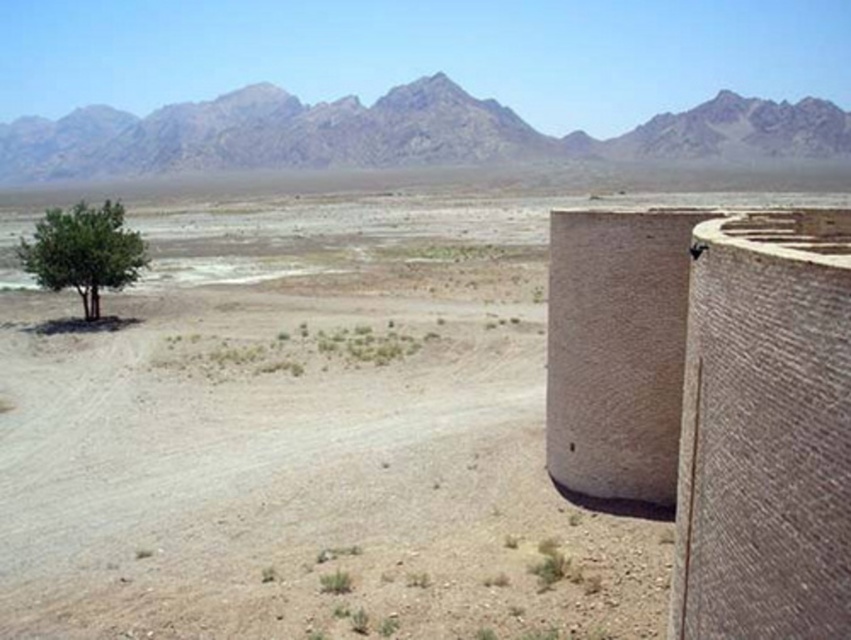
The height and width of the screenshot is (640, 851). Find the location of `dull brown dirt at center`. dull brown dirt at center is located at coordinates (318, 417).

Which of these two, dull brown dirt at center or rugged stone mountain at upper center, stands taller?

Standing taller between the two is dull brown dirt at center.

Does point (164, 499) lie in front of point (750, 122)?

Yes, it is.

Where is `dull brown dirt at center`? This screenshot has height=640, width=851. dull brown dirt at center is located at coordinates (318, 417).

Does brown textured fort at right have a greater height compared to green leafy tree at left?

Answer: In fact, brown textured fort at right may be shorter than green leafy tree at left.

Who is positioned more to the left, brown textured fort at right or green leafy tree at left?

green leafy tree at left is more to the left.

Between point (564, 236) and point (60, 209), which one is positioned behind?

Positioned behind is point (60, 209).

This screenshot has width=851, height=640. Identify the location of brown textured fort at right. (712, 401).